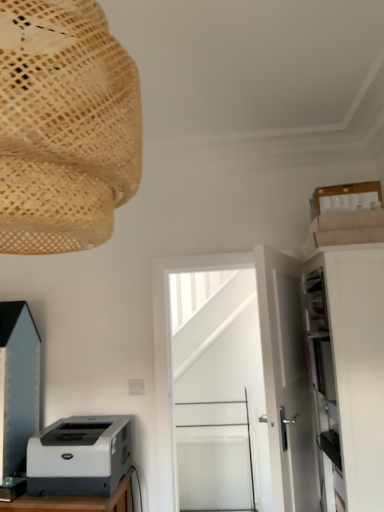
Question: Relative to white plastic printer at lower left, is matte black cabinet at lower left, which ranks as the 2th cabinetry in right-to-left order, in front or behind?

Choices:
 (A) front
 (B) behind

Answer: (B)

Question: Is matte black cabinet at lower left, the first cabinetry in the left-to-right sequence, taller or shorter than white plastic printer at lower left?

Choices:
 (A) tall
 (B) short

Answer: (A)

Question: Estimate the real-world distances between objects in this image. Which object is closer to the white matte door at center, marked as the first door in a front-to-back arrangement?

Choices:
 (A) matte black cabinet at lower left, which ranks as the 2th cabinetry in right-to-left order
 (B) white matte door at center, which is the second door from front to back
 (C) natural woven lampshade at upper left
 (D) white matte cabinet at right, the first cabinetry positioned from the right
 (E) white plastic printer at lower left

Answer: (D)

Question: Which object is positioned closest to the natural woven lampshade at upper left?

Choices:
 (A) white matte cabinet at right, the first cabinetry positioned from the right
 (B) white matte door at center, which is the second door from front to back
 (C) white matte door at center, marked as the first door in a front-to-back arrangement
 (D) matte black cabinet at lower left, the first cabinetry in the left-to-right sequence
 (E) white plastic printer at lower left

Answer: (C)